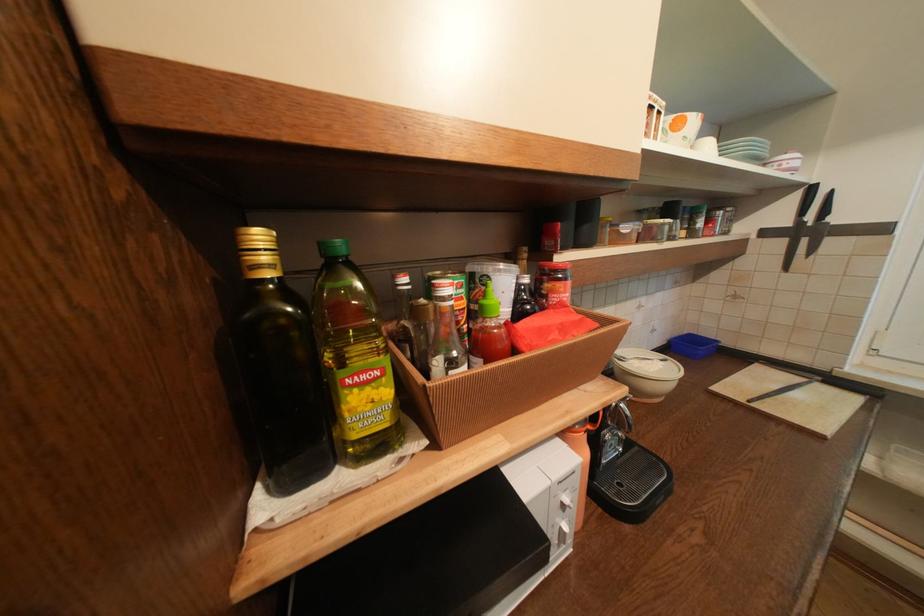
I want to click on green bottle cap, so click(354, 359).